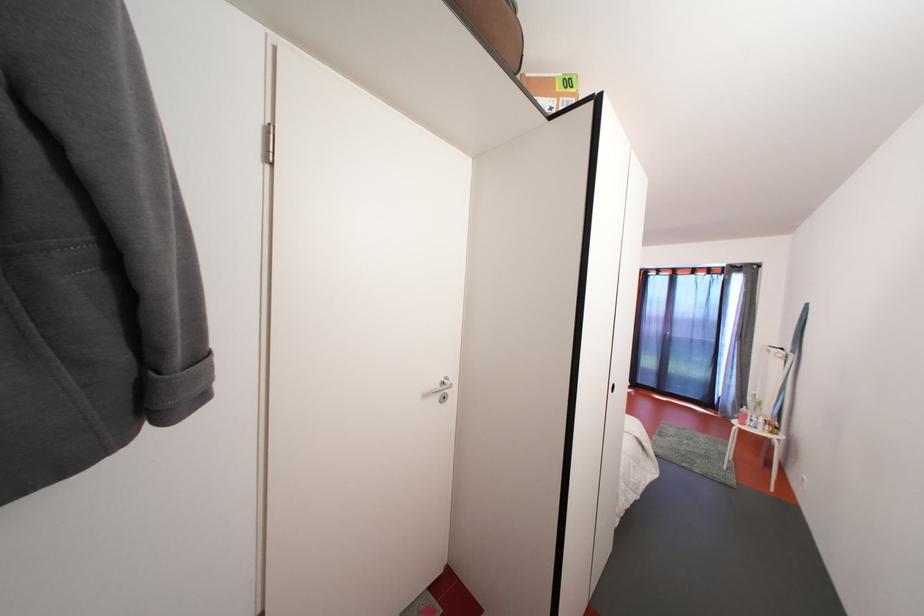
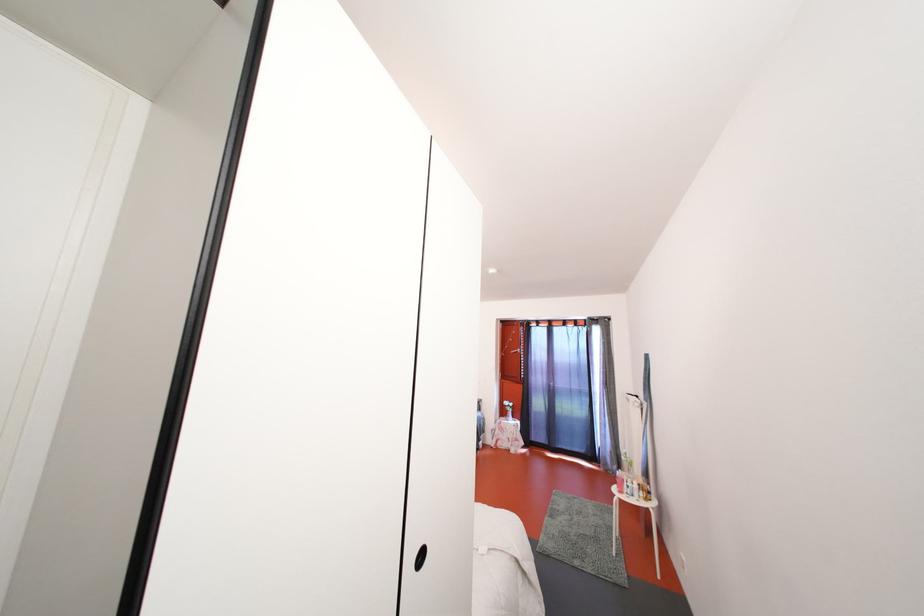
In a continuous first-person perspective shot, in which direction is the camera moving?

The cameraman moved toward right, forward.